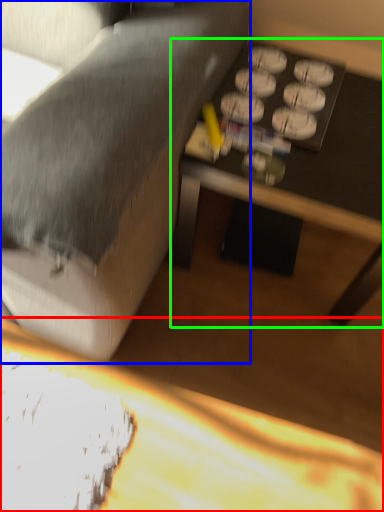
Question: Considering the real-world distances, which object is farthest from table (highlighted by a red box)? studio couch (highlighted by a blue box) or table (highlighted by a green box)?

Choices:
 (A) studio couch
 (B) table

Answer: (B)